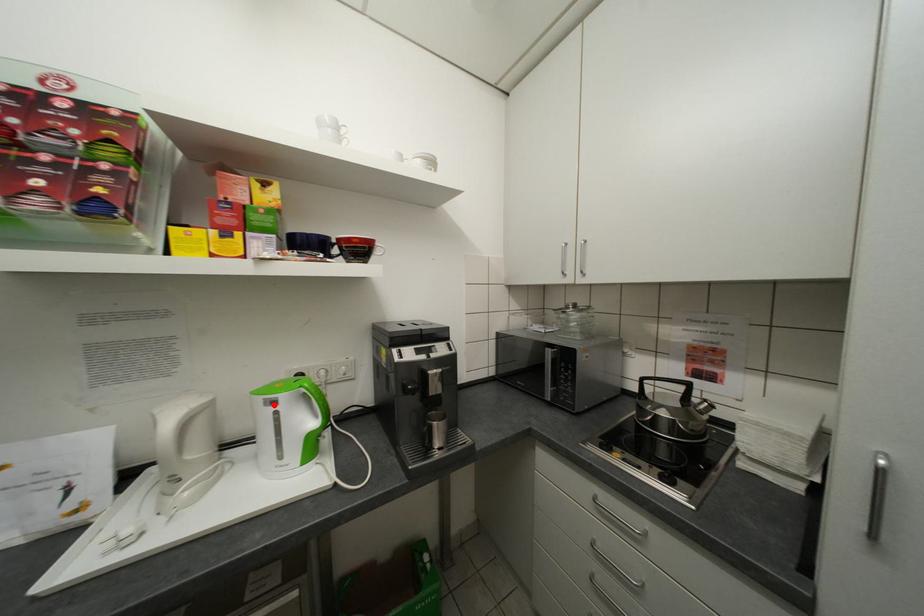
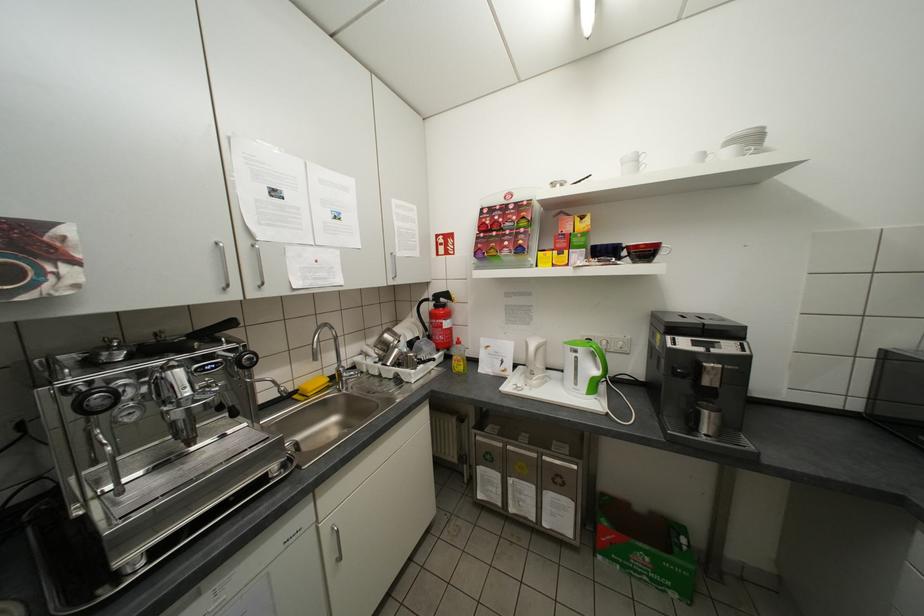
In the second image, find the point that corresponds to the highlighted location in the first image.

(579, 351)